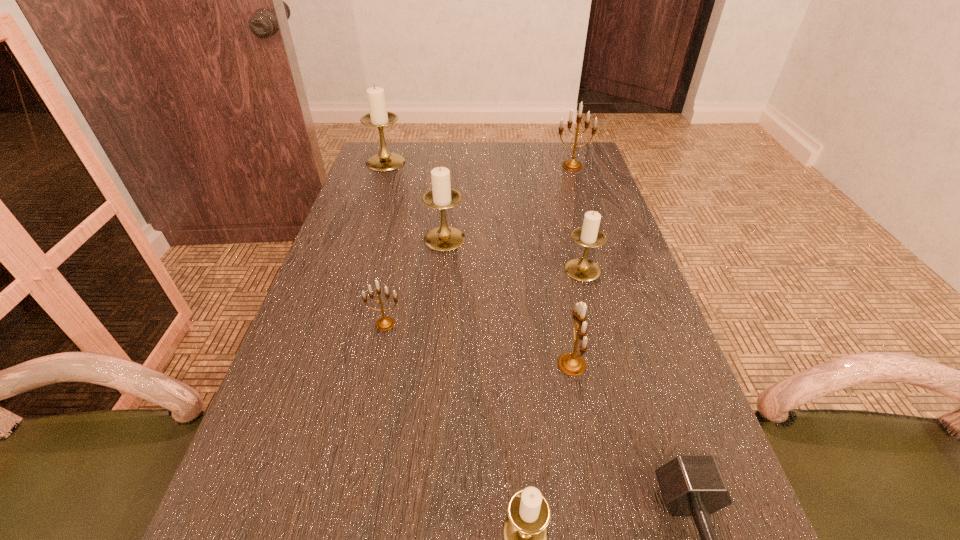
Where is `the smallest gold candelabrum`? This screenshot has height=540, width=960. the smallest gold candelabrum is located at coordinates coord(385,323).

Find the location of a particular element. the fifth farthest candle holder is located at coordinates (385, 323).

At what (x,y) coordinates should I click in order to perform the action: click on vacant space situated 0.240m on the right of the tallest object. Please return your answer as a coordinate pair (x, y). Looking at the image, I should click on (478, 163).

Find the location of a particular element. This screenshot has height=540, width=960. blank area located 0.380m on the front of the rightmost gold candelabrum is located at coordinates (597, 244).

Where is `vacant region located on the front of the third white candle holder from right to left`? vacant region located on the front of the third white candle holder from right to left is located at coordinates (431, 379).

Locate an element on the screen. vacant space located 0.130m on the left of the nearest gold candelabrum is located at coordinates (491, 364).

Locate an element on the screen. free location located 0.110m on the back of the fourth nearest candle holder is located at coordinates point(572,232).

At what (x,y) coordinates should I click in order to perform the action: click on vacant area located 0.340m on the right of the second nearest gold candelabrum. Please return your answer as a coordinate pair (x, y). Image resolution: width=960 pixels, height=540 pixels. Looking at the image, I should click on (564, 323).

I want to click on object that is at the far left corner, so click(x=379, y=117).

You are a GUI agent. You are given a task and a screenshot of the screen. Output one action in this format:
    pyautogui.click(x=<x>, y=<y>)
    Task: Click on the object that is positioned at the far right corner
    
    Given the screenshot: What is the action you would take?
    pyautogui.click(x=572, y=165)